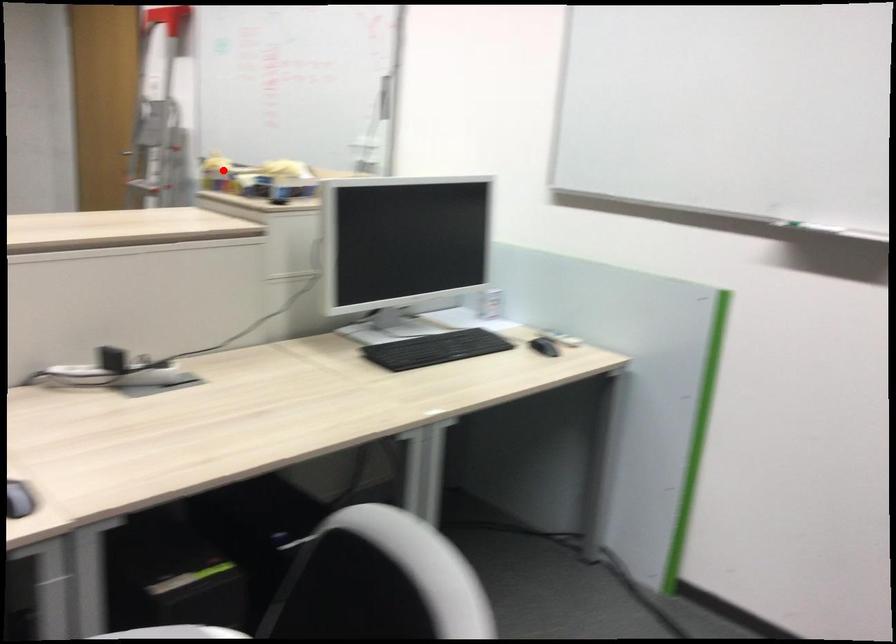
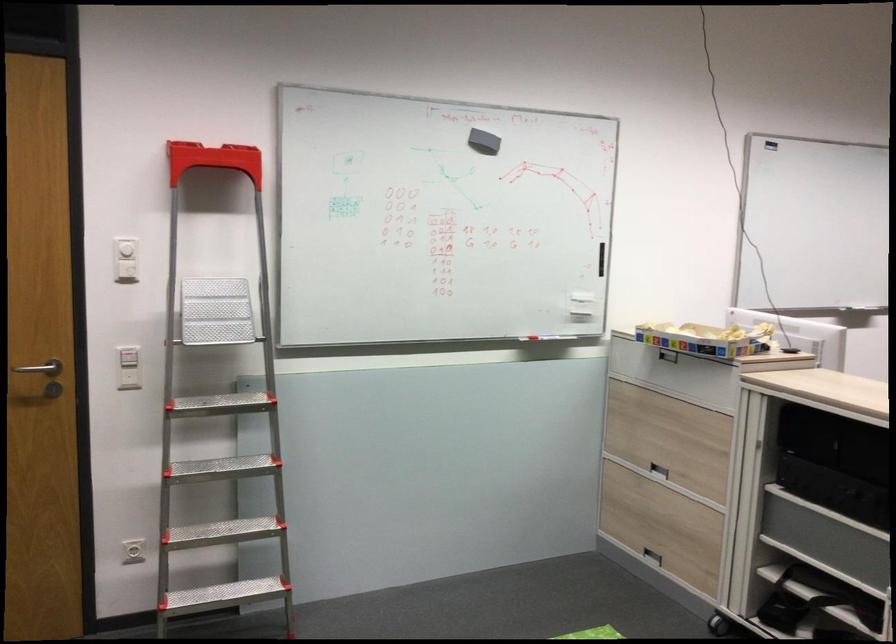
Find the pixel in the second image that matches the highlighted location in the first image.

(705, 339)